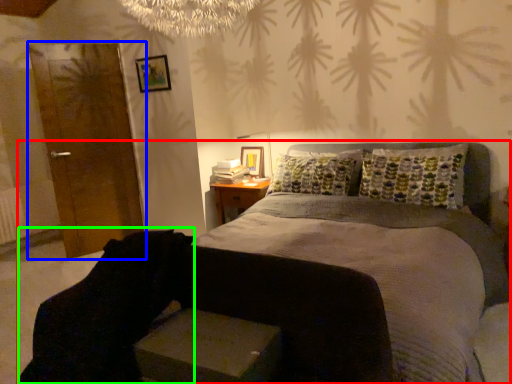
Question: Based on their relative distances, which object is farther from bed (highlighted by a red box)? Choose from armoire (highlighted by a blue box) and swivel chair (highlighted by a green box).

Choices:
 (A) armoire
 (B) swivel chair

Answer: (A)